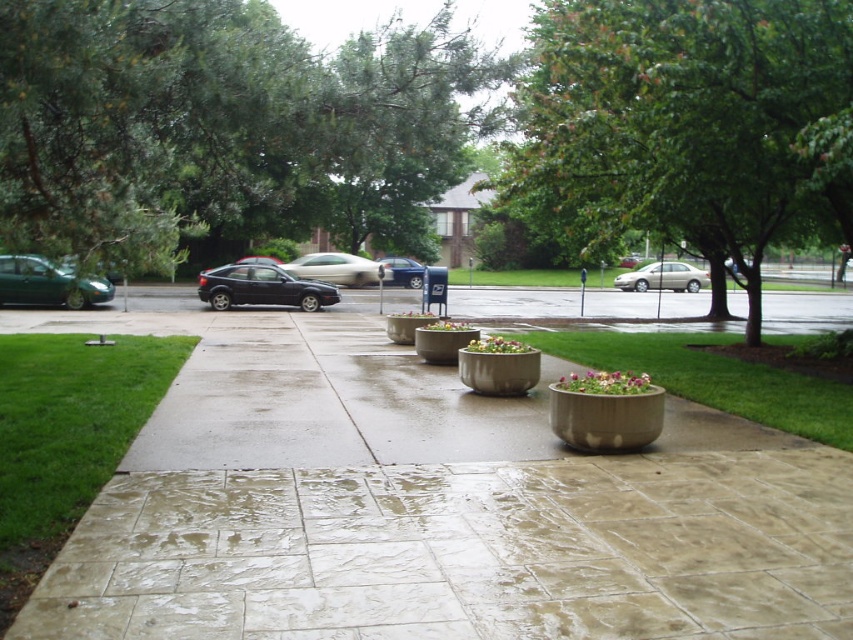
You are standing at the edge of the sidewalk in the suburban scene. You see a white glossy sedan at center and a green matte flower pot at center. How far apart are these two objects from each other?

The white glossy sedan at center is 15.02 meters away from the green matte flower pot at center.

You are a gardener who needs to determine which object is shorter between the purple matte flower pot at center and the floral arrangement at center. Can you identify the shorter one?

The purple matte flower pot at center is not as tall as the floral arrangement at center, so the purple matte flower pot at center is shorter.